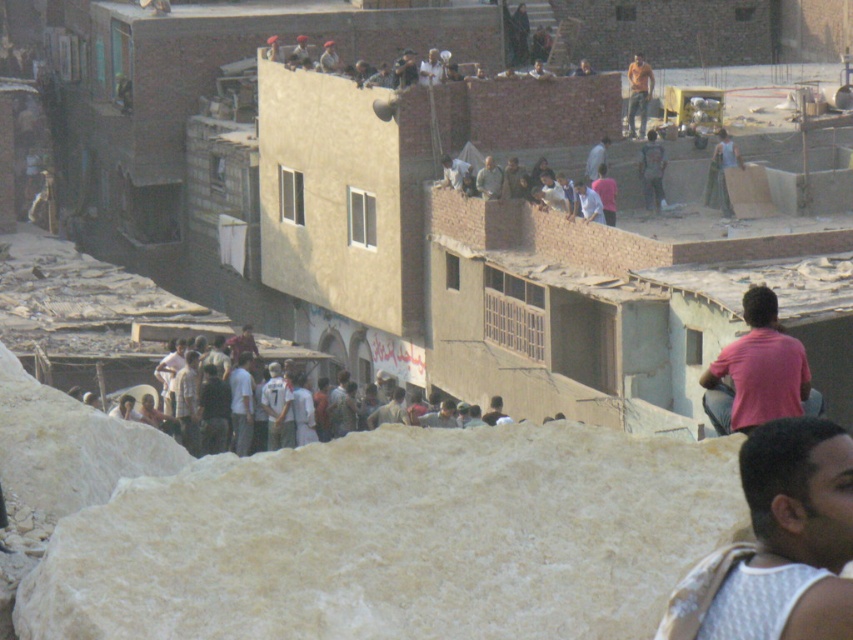
Question: Considering the real-world distances, which object is farthest from the pink cotton shirt at right?

Choices:
 (A) orange t-shirt at upper center
 (B) light brown fabric shirt at upper center
 (C) white textured shirt at lower right
 (D) white cotton shirt at lower left

Answer: (A)

Question: From the image, what is the correct spatial relationship of pink cotton shirt at right in relation to light brown fabric shirt at upper center?

Choices:
 (A) right
 (B) left

Answer: (A)

Question: In this image, where is white textured shirt at lower right located relative to orange t-shirt at upper center?

Choices:
 (A) below
 (B) above

Answer: (A)

Question: Which is nearer to the white textured shirt at lower right?

Choices:
 (A) white cotton shirt at lower left
 (B) orange t-shirt at upper center

Answer: (A)

Question: Estimate the real-world distances between objects in this image. Which object is closer to the light brown fabric shirt at upper center?

Choices:
 (A) pink cotton shirt at right
 (B) orange t-shirt at upper center

Answer: (B)

Question: Is pink cotton shirt at right positioned behind orange t-shirt at upper center?

Choices:
 (A) yes
 (B) no

Answer: (B)